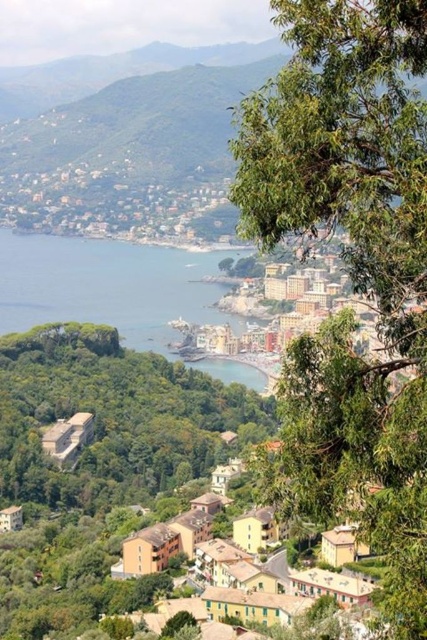
Question: Is green leafy tree at upper right to the right of blue water at center from the viewer's perspective?

Choices:
 (A) yes
 (B) no

Answer: (A)

Question: Which point is farther to the camera?

Choices:
 (A) (73, 260)
 (B) (309, 420)

Answer: (A)

Question: Can you confirm if green leafy tree at upper right is bigger than blue water at center?

Choices:
 (A) no
 (B) yes

Answer: (B)

Question: Among these points, which one is farthest from the camera?

Choices:
 (A) (412, 221)
 (B) (96, 244)

Answer: (B)

Question: Can you confirm if green leafy tree at upper right is positioned to the left of blue water at center?

Choices:
 (A) yes
 (B) no

Answer: (B)